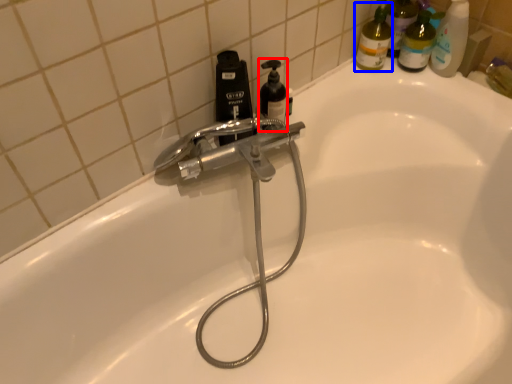
Question: Which point is further to the camera, soap dispenser (highlighted by a red box) or cleaning product (highlighted by a blue box)?

Choices:
 (A) soap dispenser
 (B) cleaning product

Answer: (B)